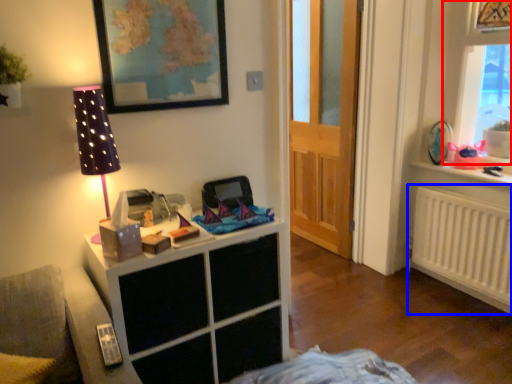
Question: Which point is further to the camera, window (highlighted by a red box) or radiator (highlighted by a blue box)?

Choices:
 (A) window
 (B) radiator

Answer: (B)